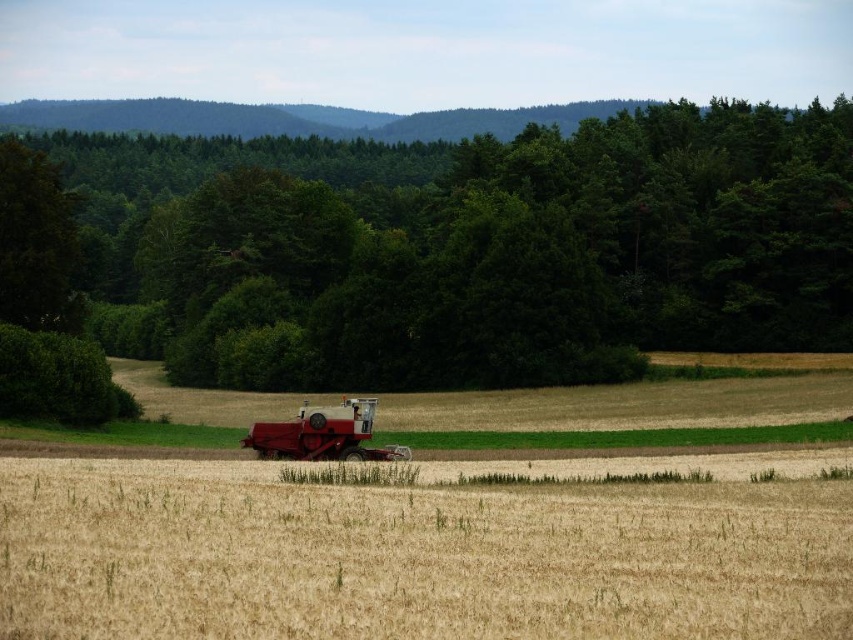
Question: Which of the following is the farthest from the observer?

Choices:
 (A) golden grain field at center
 (B) green leafy tree at center
 (C) metallic red combine at center

Answer: (B)

Question: Does green leafy tree at center appear on the left side of golden grain field at center?

Choices:
 (A) yes
 (B) no

Answer: (B)

Question: Does green leafy tree at center have a lesser width compared to metallic red combine at center?

Choices:
 (A) no
 (B) yes

Answer: (A)

Question: Which of these objects is positioned closest to the green leafy tree at center?

Choices:
 (A) metallic red combine at center
 (B) golden grain field at center

Answer: (B)

Question: Is green leafy tree at center closer to the viewer compared to golden grain field at center?

Choices:
 (A) yes
 (B) no

Answer: (B)

Question: Which point appears farthest from the camera in this image?

Choices:
 (A) (323, 433)
 (B) (434, 602)

Answer: (A)